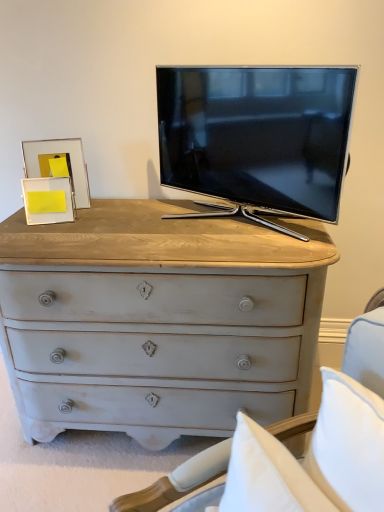
Question: From a real-world perspective, is gold metallic picture frame at upper left, which is counted as the 1th picture frame, starting from the back, positioned over distressed white chest of drawers at center based on gravity?

Choices:
 (A) yes
 (B) no

Answer: (A)

Question: Can you confirm if gold metallic picture frame at upper left, arranged as the second picture frame when viewed from the front, is positioned to the left of distressed white chest of drawers at center?

Choices:
 (A) no
 (B) yes

Answer: (B)

Question: Considering the relative sizes of gold metallic picture frame at upper left, arranged as the second picture frame when viewed from the front, and distressed white chest of drawers at center in the image provided, is gold metallic picture frame at upper left, arranged as the second picture frame when viewed from the front, smaller than distressed white chest of drawers at center?

Choices:
 (A) no
 (B) yes

Answer: (B)

Question: From a real-world perspective, is gold metallic picture frame at upper left, which is counted as the 1th picture frame, starting from the back, under distressed white chest of drawers at center?

Choices:
 (A) yes
 (B) no

Answer: (B)

Question: Could you tell me if gold metallic picture frame at upper left, which is counted as the 1th picture frame, starting from the back, is facing distressed white chest of drawers at center?

Choices:
 (A) yes
 (B) no

Answer: (A)

Question: Is point (87, 199) closer or farther from the camera than point (226, 208)?

Choices:
 (A) closer
 (B) farther

Answer: (B)

Question: From a real-world perspective, is gold metallic picture frame at upper left, arranged as the second picture frame when viewed from the front, positioned above or below matte black tv at center?

Choices:
 (A) above
 (B) below

Answer: (B)

Question: Considering their positions, is gold metallic picture frame at upper left, which is counted as the 1th picture frame, starting from the back, located in front of or behind matte black tv at center?

Choices:
 (A) behind
 (B) front

Answer: (A)

Question: Is gold metallic picture frame at upper left, which is counted as the 1th picture frame, starting from the back, bigger or smaller than matte black tv at center?

Choices:
 (A) small
 (B) big

Answer: (A)

Question: From a real-world perspective, is distressed white chest of drawers at center physically located above or below gold metallic picture frame at upper left, which is counted as the 1th picture frame, starting from the back?

Choices:
 (A) above
 (B) below

Answer: (B)

Question: From their relative heights in the image, would you say distressed white chest of drawers at center is taller or shorter than gold metallic picture frame at upper left, arranged as the second picture frame when viewed from the front?

Choices:
 (A) tall
 (B) short

Answer: (A)

Question: Considering the positions of distressed white chest of drawers at center and gold metallic picture frame at upper left, arranged as the second picture frame when viewed from the front, in the image, is distressed white chest of drawers at center bigger or smaller than gold metallic picture frame at upper left, arranged as the second picture frame when viewed from the front,?

Choices:
 (A) small
 (B) big

Answer: (B)

Question: Considering the positions of distressed white chest of drawers at center and gold metallic picture frame at upper left, which is counted as the 1th picture frame, starting from the back, in the image, is distressed white chest of drawers at center wider or thinner than gold metallic picture frame at upper left, which is counted as the 1th picture frame, starting from the back,?

Choices:
 (A) wide
 (B) thin

Answer: (A)

Question: Would you say yellow paper at left, the second picture frame viewed from the back, is inside or outside matte black tv at center?

Choices:
 (A) outside
 (B) inside

Answer: (A)

Question: From the image's perspective, relative to matte black tv at center, is yellow paper at left, which ranks as the 1th picture frame in front-to-back order, above or below?

Choices:
 (A) below
 (B) above

Answer: (A)